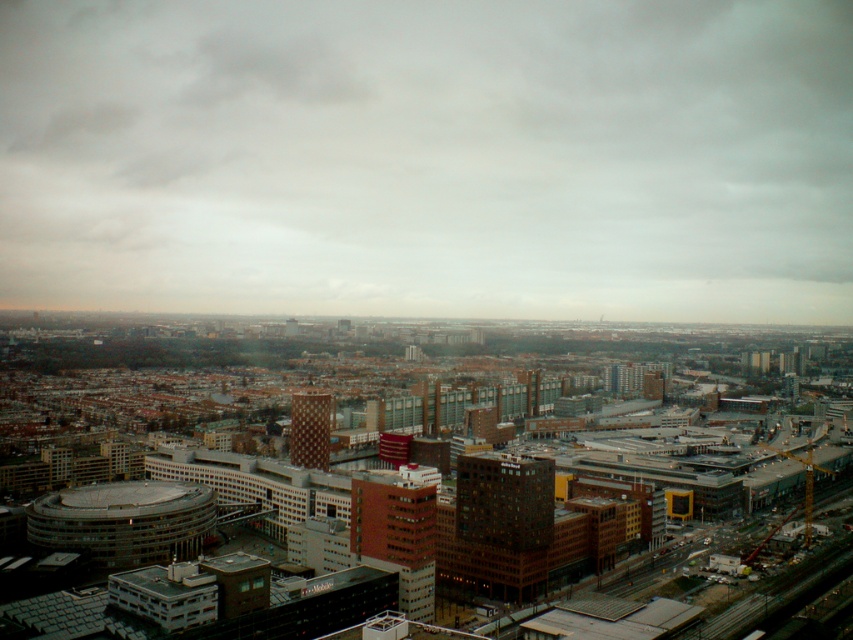
Question: Which object is farther from the camera taking this photo?

Choices:
 (A) brick building at center
 (B) brown textured tower at center
 (C) brown brick building at center

Answer: (B)

Question: Among these points, which one is nearest to the camera?

Choices:
 (A) (316, 452)
 (B) (389, 502)

Answer: (B)

Question: Does brown brick building at center lie in front of brown textured tower at center?

Choices:
 (A) no
 (B) yes

Answer: (B)

Question: Does brick building at center appear over brown textured tower at center?

Choices:
 (A) no
 (B) yes

Answer: (B)

Question: Which of the following is the farthest from the observer?

Choices:
 (A) brick building at center
 (B) brown textured tower at center

Answer: (B)

Question: Does brown brick building at center have a lesser width compared to brown textured tower at center?

Choices:
 (A) yes
 (B) no

Answer: (B)